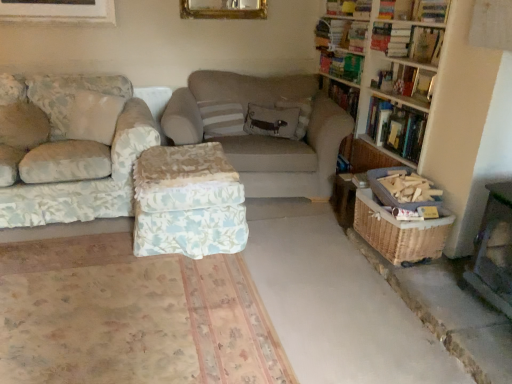
Question: Could you tell me if hardcover book at upper right, arranged as the 5th book when ordered from the bottom, is facing wooden bookshelf at right?

Choices:
 (A) no
 (B) yes

Answer: (B)

Question: Would you say wooden bookshelf at right is part of hardcover book at upper right, arranged as the 5th book when ordered from the bottom,'s contents?

Choices:
 (A) yes
 (B) no

Answer: (B)

Question: Does hardcover book at upper right, arranged as the 5th book when ordered from the bottom, lie behind wooden bookshelf at right?

Choices:
 (A) yes
 (B) no

Answer: (A)

Question: Is hardcover book at upper right, which appears as the 1th book when viewed from the top, smaller than wooden bookshelf at right?

Choices:
 (A) no
 (B) yes

Answer: (B)

Question: Would you say hardcover book at upper right, which appears as the 1th book when viewed from the top, is outside wooden bookshelf at right?

Choices:
 (A) yes
 (B) no

Answer: (B)

Question: Visually, is light brown fabric pillow at center, which is counted as the 2th pillow, starting from the right, positioned to the left or to the right of woven wicker basket at lower right?

Choices:
 (A) left
 (B) right

Answer: (A)

Question: In the image, is light brown fabric pillow at center, which is counted as the 2th pillow, starting from the right, positioned in front of or behind woven wicker basket at lower right?

Choices:
 (A) behind
 (B) front

Answer: (A)

Question: Looking at the image, does light brown fabric pillow at center, the 1th pillow from the left, seem bigger or smaller compared to woven wicker basket at lower right?

Choices:
 (A) small
 (B) big

Answer: (A)

Question: From the image's perspective, relative to woven wicker basket at lower right, is light brown fabric pillow at center, which is counted as the 2th pillow, starting from the right, above or below?

Choices:
 (A) above
 (B) below

Answer: (A)

Question: Relative to smooth concrete floor at center, acting as the second concrete starting from the right, is floral fabric couch at left, the second studio couch when ordered from right to left, in front or behind?

Choices:
 (A) front
 (B) behind

Answer: (B)

Question: Is point (101, 114) positioned closer to the camera than point (357, 319)?

Choices:
 (A) closer
 (B) farther

Answer: (B)

Question: From the image's perspective, is floral fabric couch at left, arranged as the 1th studio couch when viewed from the left, positioned above or below smooth concrete floor at center, acting as the second concrete starting from the right?

Choices:
 (A) above
 (B) below

Answer: (A)

Question: In the image, is floral fabric couch at left, the second studio couch when ordered from right to left, on the left side or the right side of smooth concrete floor at center, acting as the second concrete starting from the right?

Choices:
 (A) left
 (B) right

Answer: (A)

Question: From the image's perspective, is embroidered fabric pillow at center, the second pillow from the left, positioned above or below floral fabric couch at left, arranged as the 1th studio couch when viewed from the left?

Choices:
 (A) below
 (B) above

Answer: (B)

Question: Looking at the image, does embroidered fabric pillow at center, the 1th pillow in the right-to-left sequence, seem bigger or smaller compared to floral fabric couch at left, arranged as the 1th studio couch when viewed from the left?

Choices:
 (A) big
 (B) small

Answer: (B)